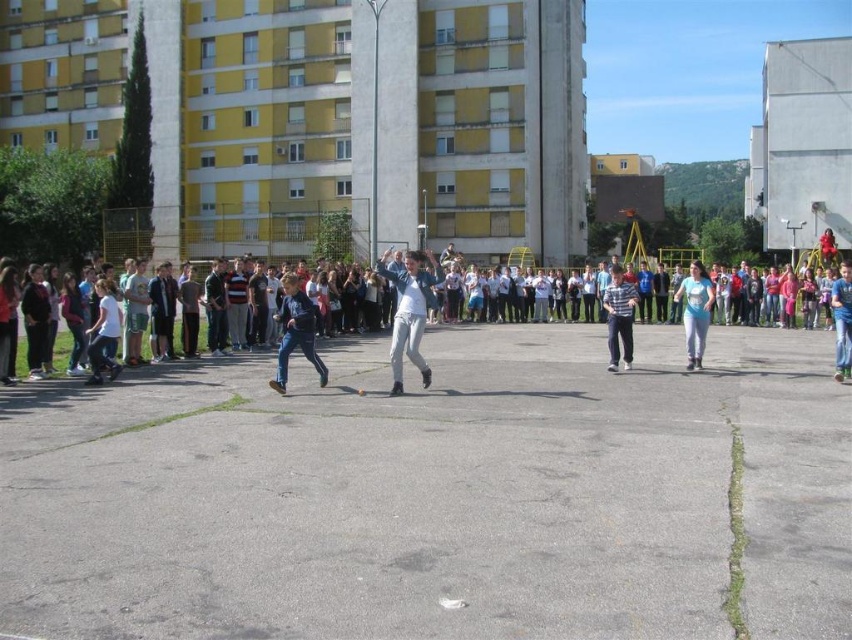
Question: Is dark blue jeans at center below light blue denim jeans at center?

Choices:
 (A) yes
 (B) no

Answer: (A)

Question: Which point is farther to the camera?

Choices:
 (A) (300, 310)
 (B) (845, 305)

Answer: (B)

Question: Which of the following is the closest to the observer?

Choices:
 (A) light gray fabric pants at center
 (B) blue jeans at center

Answer: (A)

Question: Can you confirm if light gray fabric pants at center is positioned to the left of blue jeans at center?

Choices:
 (A) no
 (B) yes

Answer: (B)

Question: Is light gray fabric pants at center to the right of striped cotton shirt at center from the viewer's perspective?

Choices:
 (A) yes
 (B) no

Answer: (B)

Question: Among these objects, which one is farthest from the camera?

Choices:
 (A) light blue denim jeans at center
 (B) light gray fabric pants at center
 (C) light blue jeans at center
 (D) dark blue jeans at center

Answer: (A)